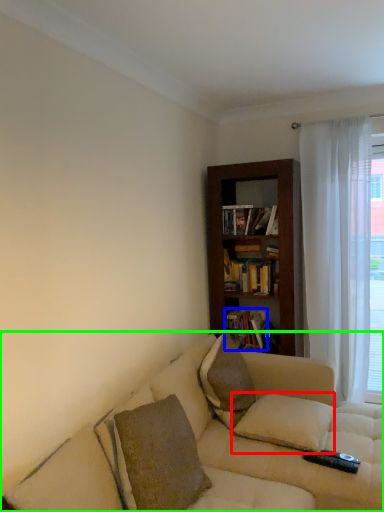
Question: Estimate the real-world distances between objects in this image. Which object is closer to pillow (highlighted by a red box), book (highlighted by a blue box) or studio couch (highlighted by a green box)?

Choices:
 (A) book
 (B) studio couch

Answer: (B)